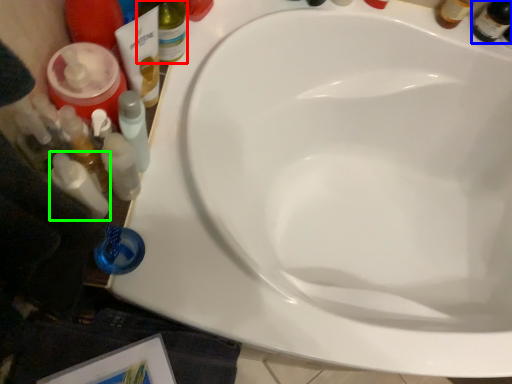
Question: Which object is the closest to the bottle (highlighted by a red box)? Choose among these: beer bottle (highlighted by a blue box) or toiletry (highlighted by a green box).

Choices:
 (A) beer bottle
 (B) toiletry

Answer: (B)